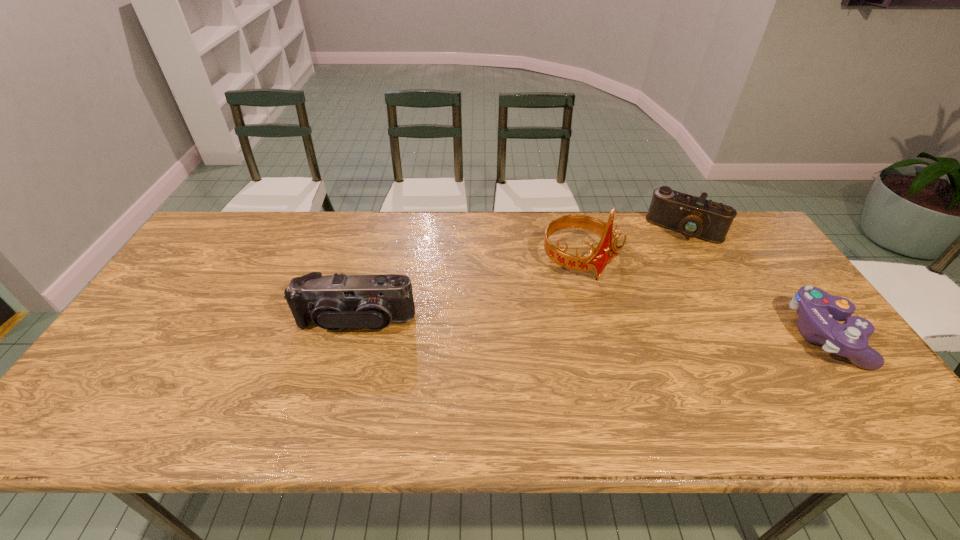
The height and width of the screenshot is (540, 960). What are the coordinates of `free space located 0.190m on the front-facing side of the third object from right to left` in the screenshot? It's located at (639, 331).

Image resolution: width=960 pixels, height=540 pixels. Find the location of `blank space located 0.400m on the front-facing side of the third object from right to left`. blank space located 0.400m on the front-facing side of the third object from right to left is located at coordinates (696, 396).

You are a GUI agent. You are given a task and a screenshot of the screen. Output one action in this format:
    pyautogui.click(x=<x>, y=<y>)
    Task: Click on the vacant space positioned 0.100m on the front-facing side of the third object from right to left
    The height and width of the screenshot is (540, 960).
    Given the screenshot: What is the action you would take?
    pyautogui.click(x=619, y=307)

Locate an element on the screen. The height and width of the screenshot is (540, 960). vacant point located on the lens of the second shortest object is located at coordinates (647, 299).

What are the coordinates of `vacant space situated on the lens of the second shortest object` in the screenshot? It's located at (658, 276).

Where is `vacant space located 0.310m on the lens of the second shortest object`? vacant space located 0.310m on the lens of the second shortest object is located at coordinates (644, 303).

Identify the location of tiara located at the far edge. (597, 259).

Where is `camera located in the far edge section of the desktop`? camera located in the far edge section of the desktop is located at coordinates (694, 217).

The image size is (960, 540). Find the location of `object that is at the near edge`. object that is at the near edge is located at coordinates (817, 310).

At what (x,y) coordinates should I click in order to perform the action: click on control positioned at the right edge. Please return your answer as a coordinate pair (x, y). Looking at the image, I should click on (817, 310).